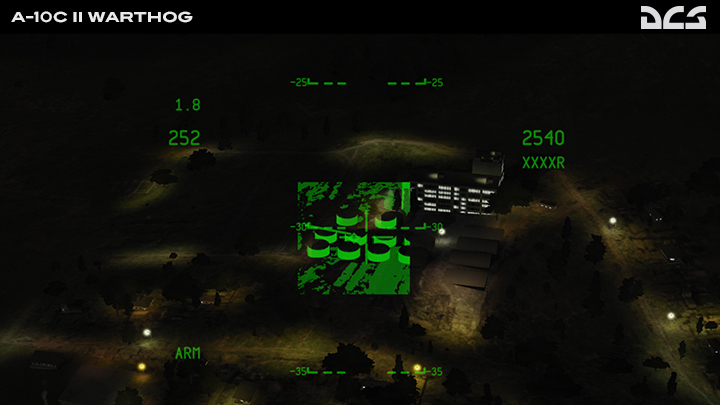
Where is `square picture in green`? This screenshot has width=720, height=405. square picture in green is located at coordinates (361, 232).